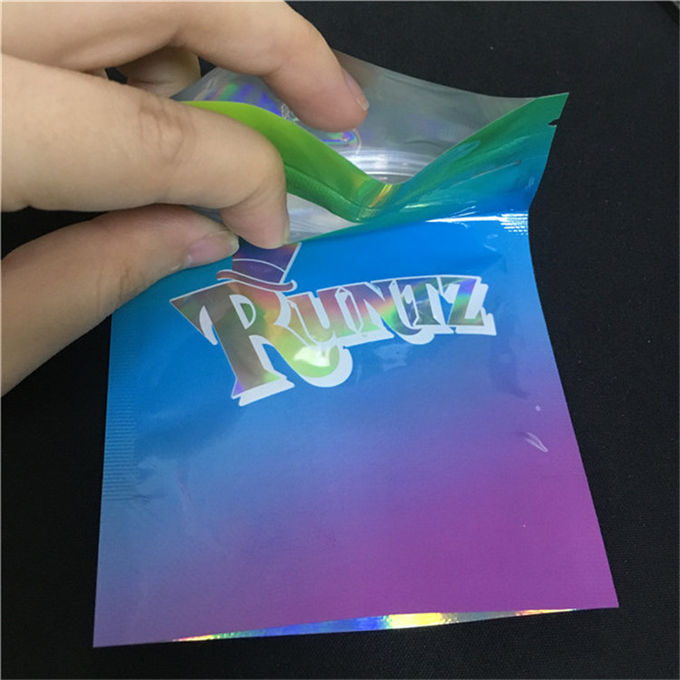
Find the location of a particular element. spot on table/object is located at coordinates (493, 51).